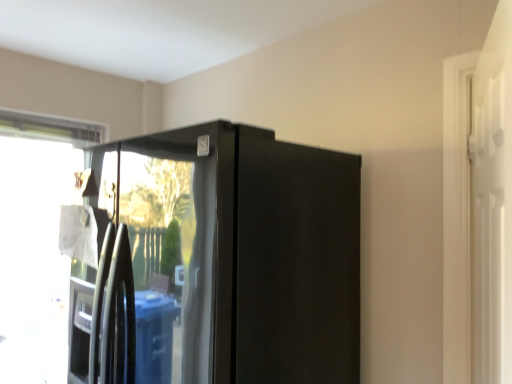
Identify the location of transparent glass window at left. (36, 241).

From the image's perspective, does glossy black refrigerator at center appear higher than transparent glass window at left?

Indeed, from the image's perspective, glossy black refrigerator at center is shown above transparent glass window at left.

Can you confirm if glossy black refrigerator at center is thinner than transparent glass window at left?

In fact, glossy black refrigerator at center might be wider than transparent glass window at left.

I want to click on window behind the glossy black refrigerator at center, so click(x=36, y=241).

Could you tell me if glossy black refrigerator at center is turned towards transparent glass window at left?

No, glossy black refrigerator at center is not oriented towards transparent glass window at left.

Which of these two, transparent glass window at left or glossy black refrigerator at center, is bigger?

Bigger between the two is glossy black refrigerator at center.

Can we say transparent glass window at left lies outside glossy black refrigerator at center?

Indeed, transparent glass window at left is completely outside glossy black refrigerator at center.

Does transparent glass window at left have a greater width compared to glossy black refrigerator at center?

No.

Can you confirm if transparent glass window at left is shorter than glossy black refrigerator at center?

No, transparent glass window at left is not shorter than glossy black refrigerator at center.

From a real-world perspective, between transparent glass window at left and white glossy screen door at right, who is vertically higher?

In real-world perspective, white glossy screen door at right is above.

Is transparent glass window at left bigger or smaller than white glossy screen door at right?

transparent glass window at left is bigger than white glossy screen door at right.

Does point (1, 211) lie behind point (493, 144)?

Yes, it is.

Is transparent glass window at left looking in the opposite direction of white glossy screen door at right?

transparent glass window at left does not have its back to white glossy screen door at right.

Is glossy black refrigerator at center oriented towards white glossy screen door at right?

No, glossy black refrigerator at center is not turned towards white glossy screen door at right.

From the image's perspective, between glossy black refrigerator at center and white glossy screen door at right, which one is located above?

white glossy screen door at right.

Can you tell me how much glossy black refrigerator at center and white glossy screen door at right differ in facing direction?

116 degrees separate the facing orientations of glossy black refrigerator at center and white glossy screen door at right.

Considering the sizes of white glossy screen door at right and transparent glass window at left in the image, is white glossy screen door at right wider or thinner than transparent glass window at left?

Clearly, white glossy screen door at right has less width compared to transparent glass window at left.

Which object is positioned more to the right, white glossy screen door at right or transparent glass window at left?

From the viewer's perspective, white glossy screen door at right appears more on the right side.

Does white glossy screen door at right have a lesser height compared to transparent glass window at left?

Yes, white glossy screen door at right is shorter than transparent glass window at left.

Considering the positions of objects white glossy screen door at right and glossy black refrigerator at center in the image provided, who is more to the left, white glossy screen door at right or glossy black refrigerator at center?

glossy black refrigerator at center is more to the left.

Considering the positions of objects white glossy screen door at right and glossy black refrigerator at center in the image provided, who is behind, white glossy screen door at right or glossy black refrigerator at center?

Positioned behind is glossy black refrigerator at center.

Does point (497, 211) appear closer or farther from the camera than point (145, 358)?

Clearly, point (497, 211) is closer to the camera than point (145, 358).

Where is `appliance on the right side of transparent glass window at left`? Image resolution: width=512 pixels, height=384 pixels. appliance on the right side of transparent glass window at left is located at coordinates (221, 261).

The image size is (512, 384). Identify the location of window on the left of glossy black refrigerator at center. (36, 241).

When comparing their distances from transparent glass window at left, does glossy black refrigerator at center or white glossy screen door at right seem further?

white glossy screen door at right.

When comparing their distances from white glossy screen door at right, does glossy black refrigerator at center or transparent glass window at left seem closer?

The object closer to white glossy screen door at right is glossy black refrigerator at center.

Consider the image. From the image, which object appears to be farther from glossy black refrigerator at center, transparent glass window at left or white glossy screen door at right?

The object further to glossy black refrigerator at center is transparent glass window at left.

Which object lies nearer to the anchor point transparent glass window at left, white glossy screen door at right or glossy black refrigerator at center?

Based on the image, glossy black refrigerator at center appears to be nearer to transparent glass window at left.

Which object lies further to the anchor point white glossy screen door at right, transparent glass window at left or glossy black refrigerator at center?

Among the two, transparent glass window at left is located further to white glossy screen door at right.

Considering their positions, is white glossy screen door at right positioned further to glossy black refrigerator at center than transparent glass window at left?

transparent glass window at left is positioned further to the anchor glossy black refrigerator at center.

Locate an element on the screen. This screenshot has width=512, height=384. appliance between transparent glass window at left and white glossy screen door at right is located at coordinates (221, 261).